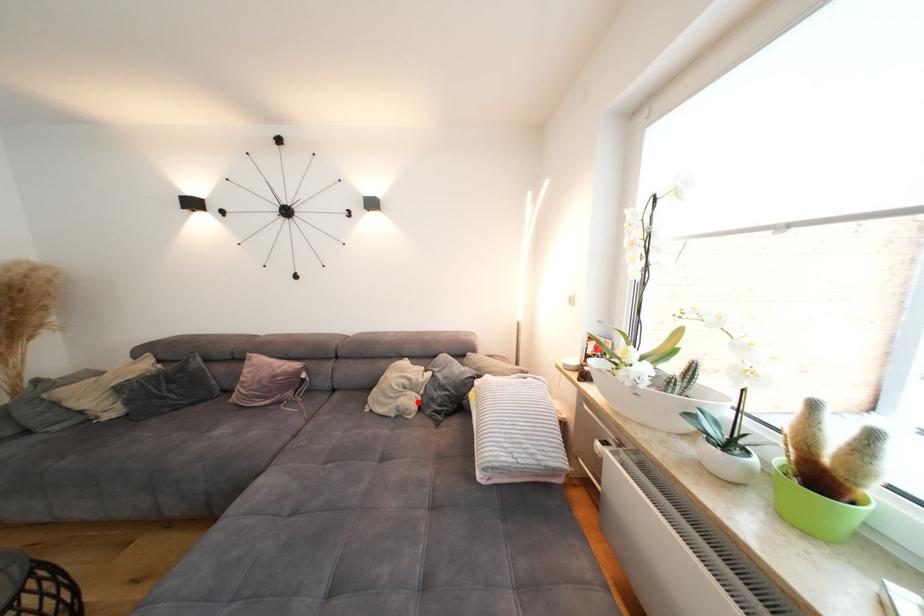
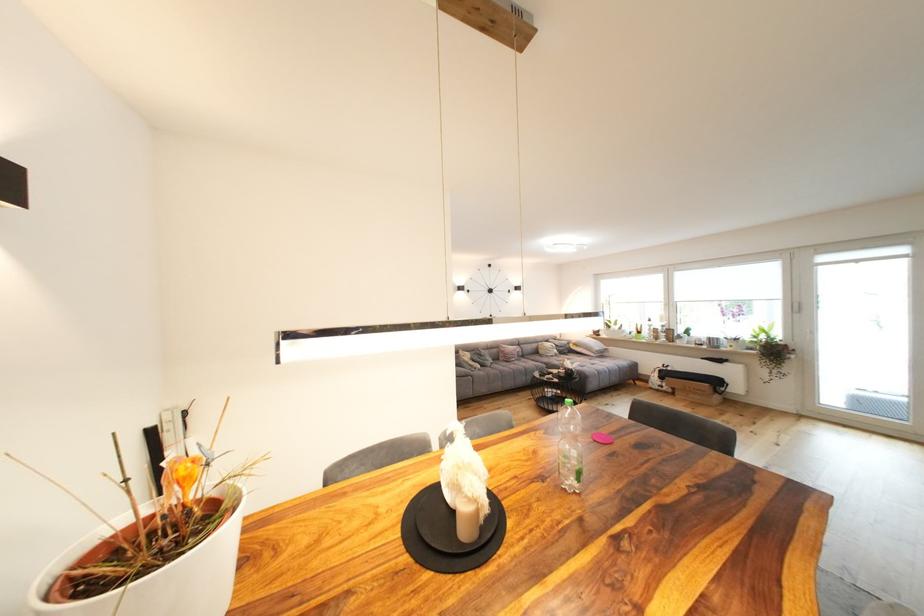
Question: I am providing you with two images of the same scene from different viewpoints. Image1 has a red point marked. In image2, the corresponding 3D location appears at what relative position? Reply with the corresponding letter.

Choices:
 (A) Closer
 (B) Farther

Answer: (B)